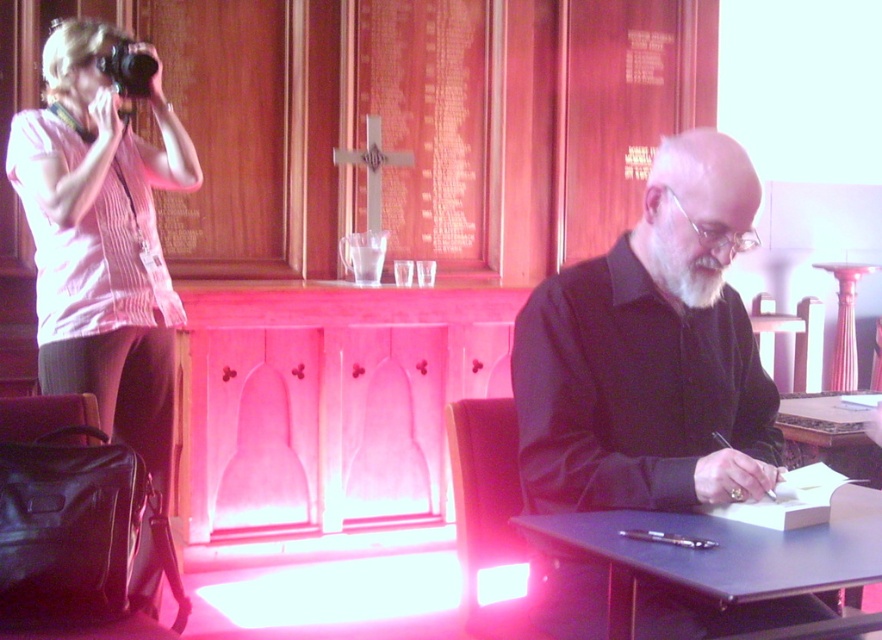
You are a photographer trying to frame a shot. You see the pink striped shirt at left and the black plastic camera at upper left in your viewfinder. Which object appears wider in the frame?

The pink striped shirt at left appears wider than the black plastic camera at upper left according to the description.

Based on the coordinates provided, which object is located at point (102, 241) in the image?

The pink striped shirt at left is located at point (102, 241) in the image.